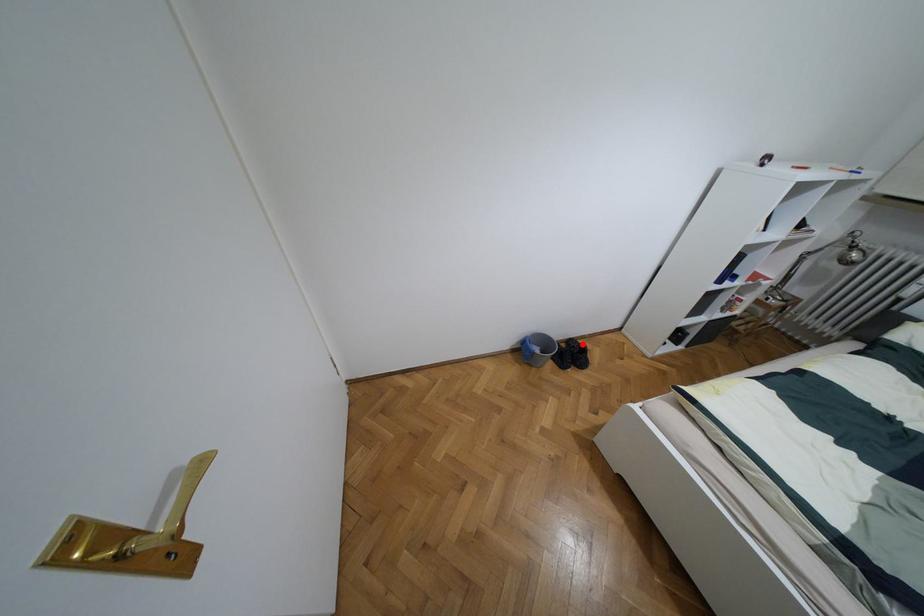
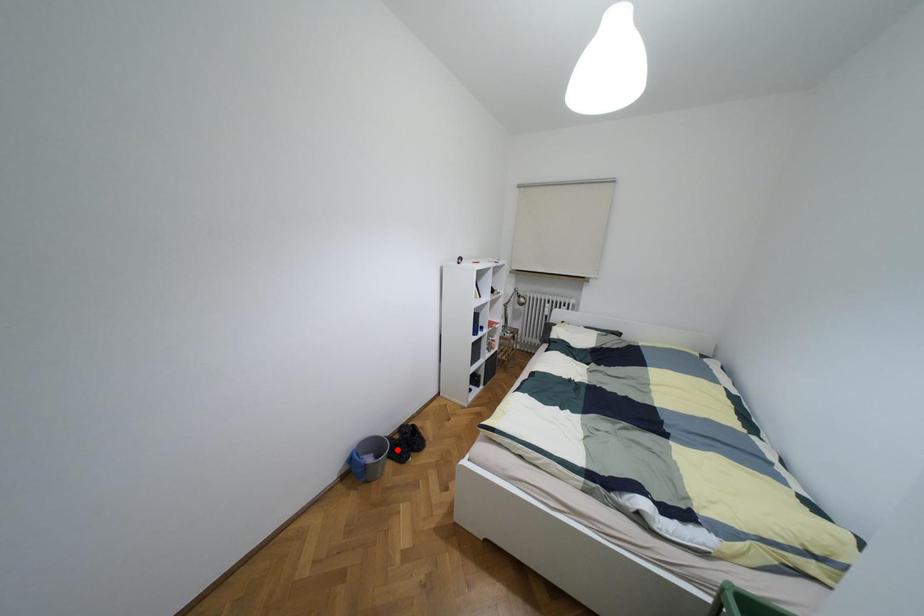
I am providing you with two images of the same scene from different viewpoints. A red point is marked on the first image and another point is marked on the second image. Is the red point in image1 aligned with the point shown in image2?

No